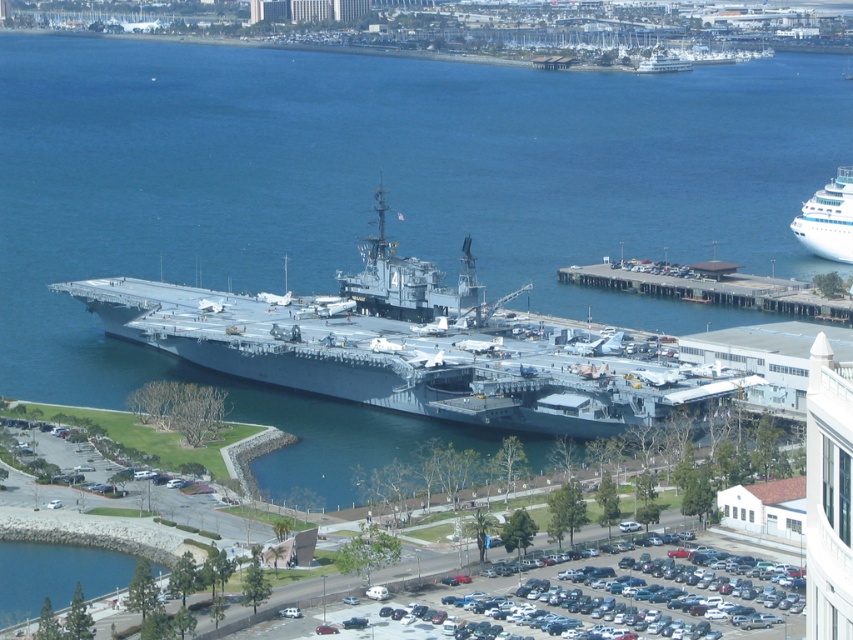
Question: Which object appears farthest from the camera in this image?

Choices:
 (A) concrete dock at center right
 (B) white glossy boat at upper right

Answer: (B)

Question: Can you confirm if white glossy cruise ship at upper right is positioned above white glossy boat at upper right?

Choices:
 (A) no
 (B) yes

Answer: (A)

Question: Which of the following is the closest to the observer?

Choices:
 (A) concrete dock at center right
 (B) gray metallic aircraft carrier at center
 (C) white glossy cruise ship at upper right

Answer: (B)

Question: Does white glossy cruise ship at upper right have a smaller size compared to white glossy boat at upper right?

Choices:
 (A) no
 (B) yes

Answer: (A)

Question: Among these objects, which one is farthest from the camera?

Choices:
 (A) concrete dock at center right
 (B) gray metallic aircraft carrier at center
 (C) white glossy cruise ship at upper right

Answer: (C)

Question: Does gray metallic aircraft carrier at center appear on the left side of concrete dock at center right?

Choices:
 (A) yes
 (B) no

Answer: (A)